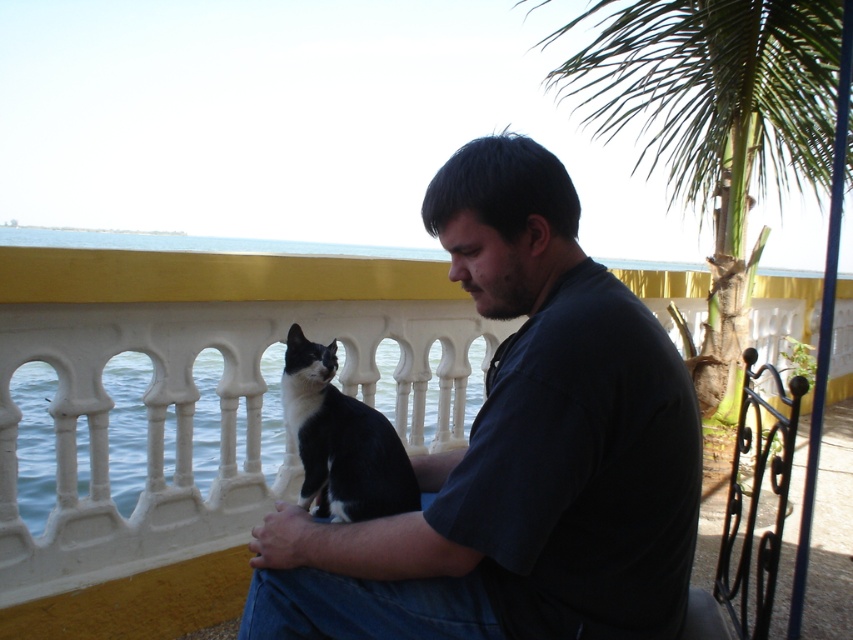
Who is positioned more to the right, green leafy palm tree at upper right or black fur cat at center?

green leafy palm tree at upper right

Can you confirm if green leafy palm tree at upper right is taller than black fur cat at center?

Indeed, green leafy palm tree at upper right has a greater height compared to black fur cat at center.

The image size is (853, 640). Find the location of `green leafy palm tree at upper right`. green leafy palm tree at upper right is located at coordinates (721, 122).

This screenshot has width=853, height=640. Describe the element at coordinates (517, 452) in the screenshot. I see `dark blue shirt at center` at that location.

Image resolution: width=853 pixels, height=640 pixels. What are the coordinates of `dark blue shirt at center` in the screenshot? It's located at (517, 452).

What do you see at coordinates (517, 452) in the screenshot? I see `dark blue shirt at center` at bounding box center [517, 452].

Locate an element on the screen. dark blue shirt at center is located at coordinates (517, 452).

Can you confirm if dark blue shirt at center is positioned above black fur cat at center?

Yes, dark blue shirt at center is above black fur cat at center.

Can you confirm if dark blue shirt at center is taller than black fur cat at center?

Indeed, dark blue shirt at center has a greater height compared to black fur cat at center.

Where is `dark blue shirt at center`? The image size is (853, 640). dark blue shirt at center is located at coordinates [517, 452].